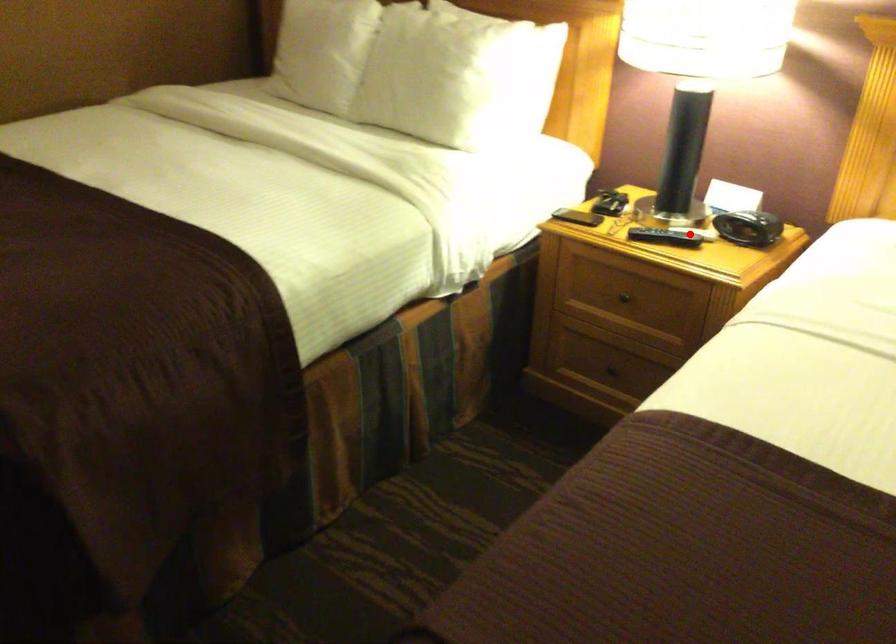
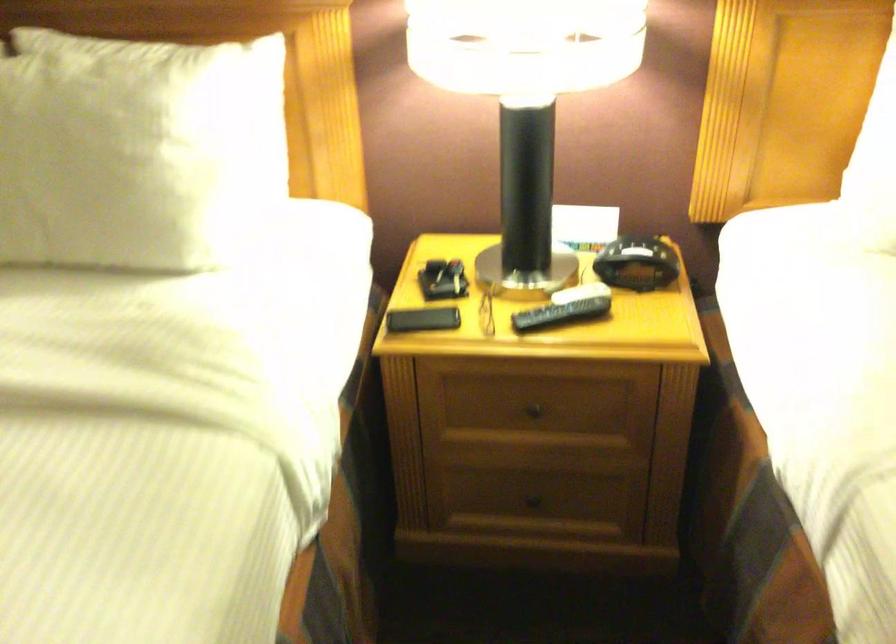
The point at the highlighted location is marked in the first image. Where is the corresponding point in the second image?

(579, 292)